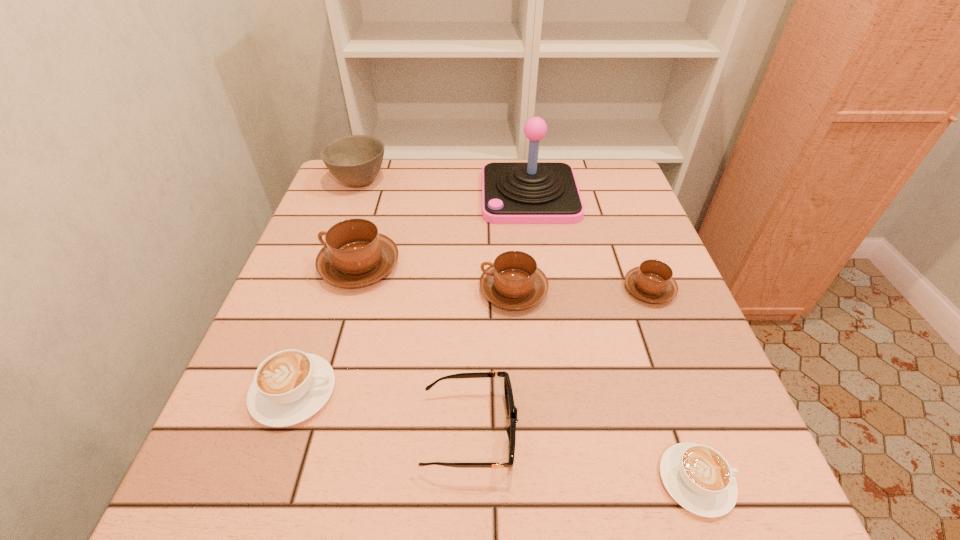
Find the location of `bowl that is at the left edge`. bowl that is at the left edge is located at coordinates (355, 160).

This screenshot has width=960, height=540. Identify the location of joystick at the right edge. (532, 192).

Locate an element on the screen. The width and height of the screenshot is (960, 540). object present at the far left corner is located at coordinates (355, 160).

Identify the location of object located at the far right corner. (532, 192).

Where is `object located at the near right corner`? This screenshot has height=540, width=960. object located at the near right corner is located at coordinates (699, 478).

The width and height of the screenshot is (960, 540). I want to click on vacant space at the far edge of the desktop, so click(x=416, y=191).

In the image, there is a desktop. At what (x,y) coordinates should I click in order to perform the action: click on free space at the near edge. Please return your answer as a coordinate pair (x, y). Looking at the image, I should click on (462, 491).

Where is `vacant space at the left edge of the desktop`? This screenshot has height=540, width=960. vacant space at the left edge of the desktop is located at coordinates (305, 432).

The image size is (960, 540). Identify the location of free region at the right edge. (706, 444).

Where is `vacant space at the far left corner of the desktop`? This screenshot has width=960, height=540. vacant space at the far left corner of the desktop is located at coordinates (368, 205).